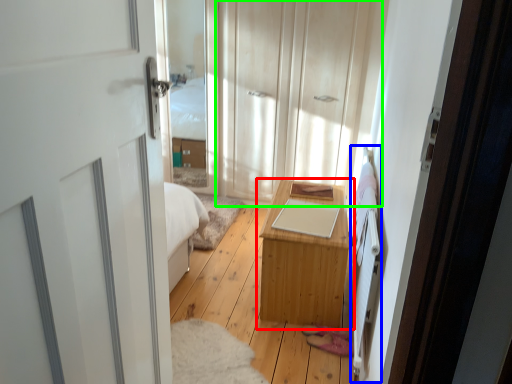
Question: Based on their relative distances, which object is nearer to table (highlighted by a red box)? Choose from bed frame (highlighted by a blue box) and dresser (highlighted by a green box).

Choices:
 (A) bed frame
 (B) dresser

Answer: (A)